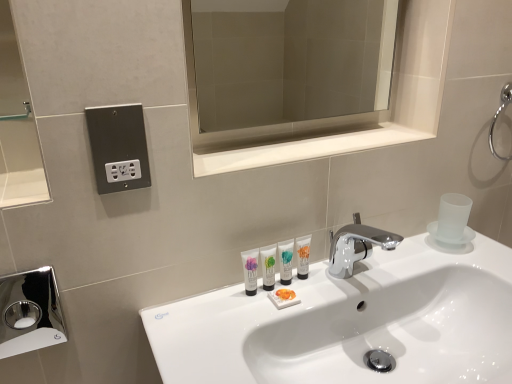
The image size is (512, 384). I want to click on vacant area located to the right-hand side of white glossy tube at center, marked as the second mouthwash in a left-to-right arrangement, so click(x=336, y=288).